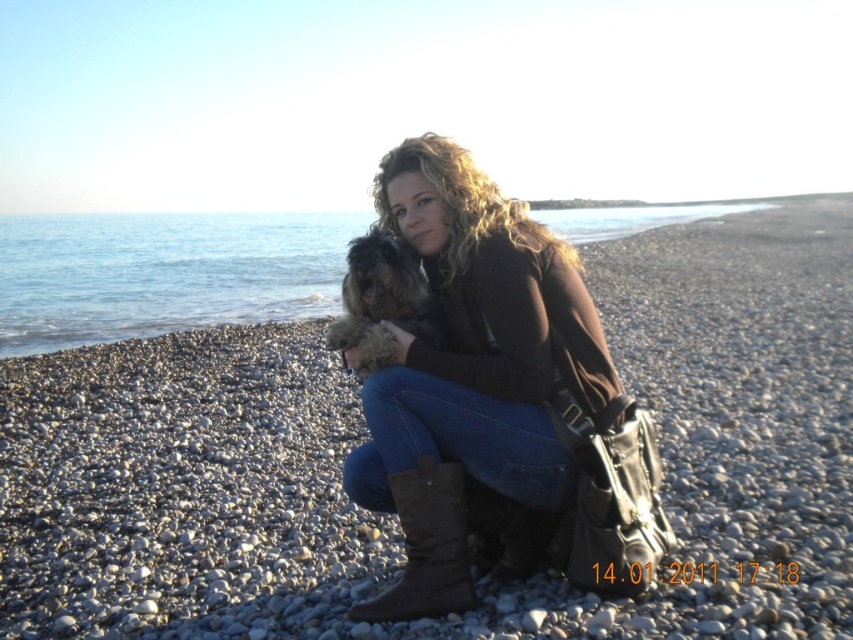
You are a photographer standing on the pebble beach at center and want to take a photo of the fuzzy brown dog at center. If your camera has a maximum focus range of 10 meters, will you be able to focus on the dog?

The pebble beach at center and fuzzy brown dog at center are 10.93 meters apart. Since the camera can only focus up to 10 meters, the distance is too far for the camera to focus on the dog.

You are standing on the beach and want to pick up a pebble from the area near the brown suede boot at lower center and the fuzzy brown dog at center. Which object is closer to you so you can reach it first?

The brown suede boot at lower center is closer to the viewer than the fuzzy brown dog at center, so you can reach it first.

You are standing on the beach and want to place a 1.2 meter long wooden board on the pebble beach at center. What is the best way to position it?

The best way to position the 1.2 meter long wooden board on the pebble beach at center would be to place it horizontally along the shore to ensure stability and proper placement.